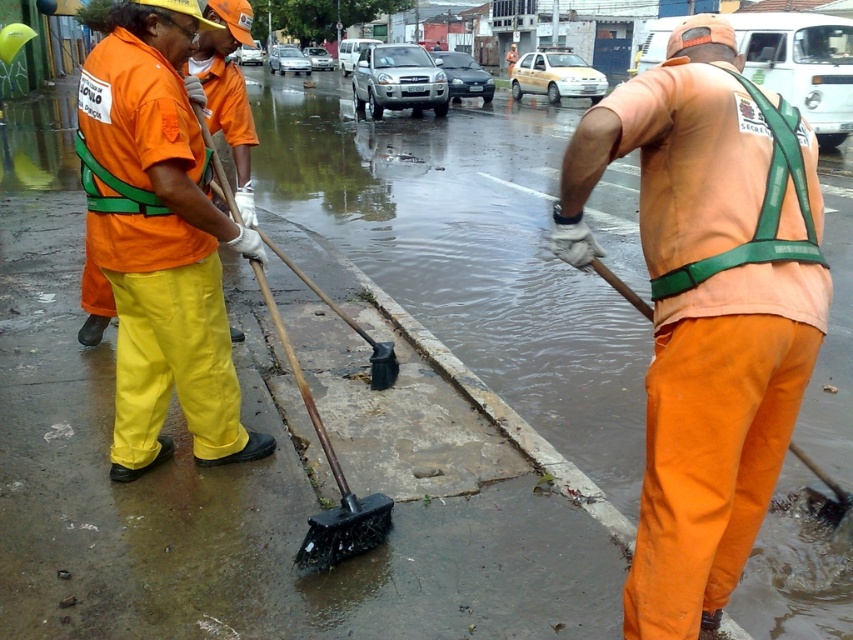
Question: Which point is farther from the camera taking this photo?

Choices:
 (A) (119, 97)
 (B) (143, 211)
 (C) (541, 113)
 (D) (711, 17)

Answer: (C)

Question: Estimate the real-world distances between objects in this image. Which object is closer to the green fabric safety vest at right?

Choices:
 (A) wet concrete sidewalk at lower center
 (B) matte orange shirt at center

Answer: (B)

Question: Can you confirm if wet concrete sidewalk at lower center is wider than green fabric safety vest at right?

Choices:
 (A) yes
 (B) no

Answer: (A)

Question: In this image, where is green fabric safety vest at right located relative to green fabric safety vest at left?

Choices:
 (A) right
 (B) left

Answer: (A)

Question: Does wet concrete sidewalk at lower center appear over matte orange shirt at center?

Choices:
 (A) no
 (B) yes

Answer: (B)

Question: Considering the real-world distances, which object is farthest from the green fabric safety vest at right?

Choices:
 (A) green fabric safety vest at left
 (B) matte orange shirt at center

Answer: (A)